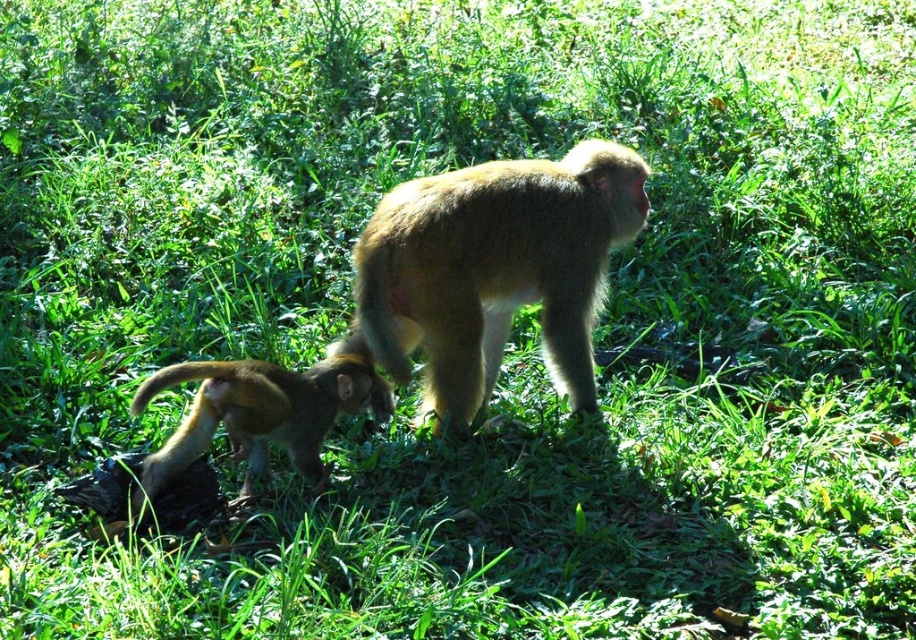
You are a wildlife photographer observing two golden fur monkeys in a grassy area. You notice the golden fur monkey at center and the golden fur monkey at lower left. From your viewpoint, which monkey is positioned higher up in the image?

The golden fur monkey at center is positioned higher up in the image than the golden fur monkey at lower left.

You are a wildlife photographer aiming to capture a photo of both the golden fur monkey at center and the golden fur monkey at lower left in the same frame. The camera you are using has a maximum focus range of 18 inches. Can you take a photo that includes both monkeys without moving the camera?

The golden fur monkey at center is 18.25 inches from the golden fur monkey at lower left. Since the camera can only focus up to 18 inches, the distance between them is slightly too far, so you cannot capture both monkeys in focus without moving the camera.